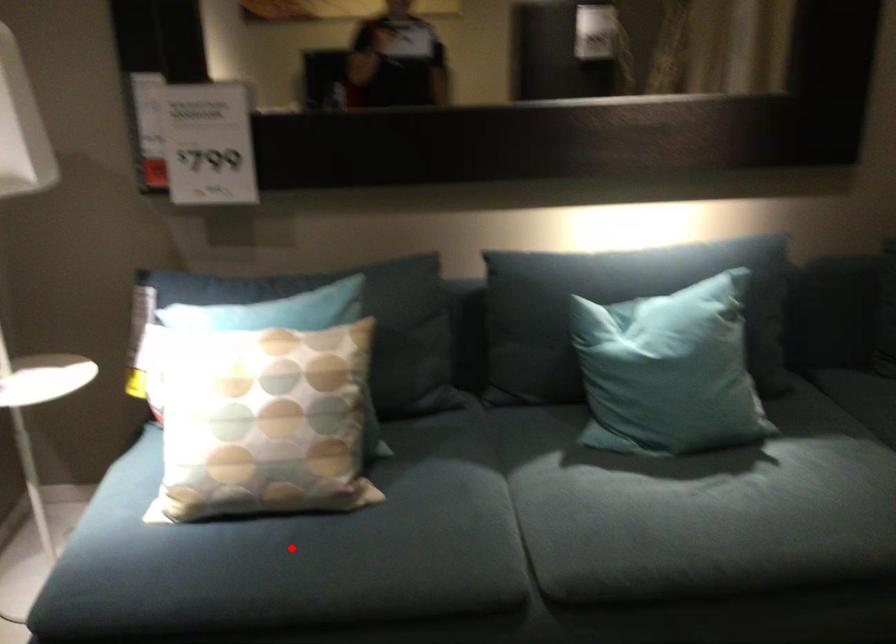
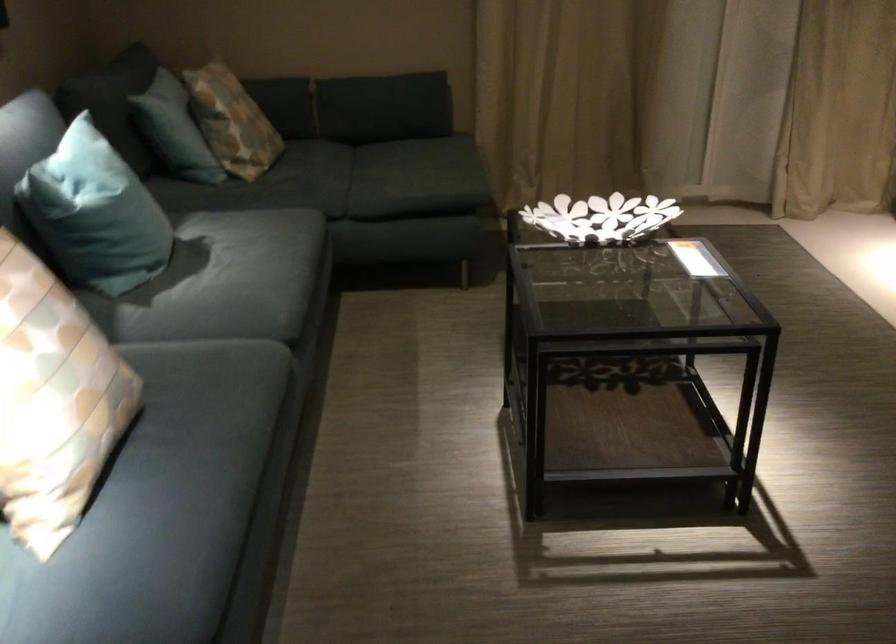
Locate, in the second image, the point that corresponds to the highlighted location in the first image.

(197, 436)